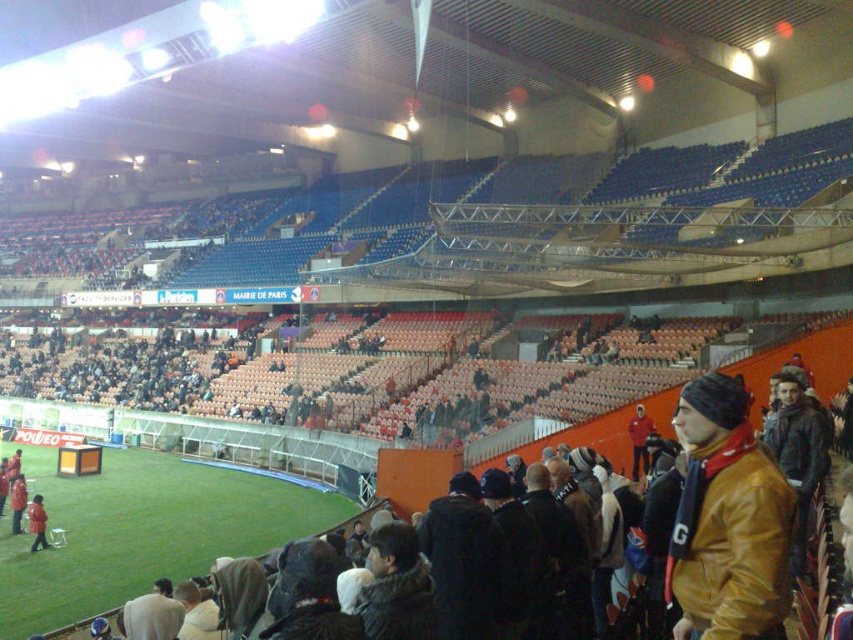
Based on the photo, which of these two, red fabric jacket at right or orange fabric jacket at lower left, stands shorter?

With less height is orange fabric jacket at lower left.

This screenshot has width=853, height=640. What do you see at coordinates (639, 440) in the screenshot? I see `red fabric jacket at right` at bounding box center [639, 440].

In order to click on red fabric jacket at right in this screenshot , I will do pyautogui.click(x=639, y=440).

Is brown leather jacket at lower right smaller than red leather jacket at lower left?

No.

Based on the photo, between brown leather jacket at lower right and red leather jacket at lower left, which one is positioned lower?

red leather jacket at lower left

Between point (761, 538) and point (10, 502), which one is positioned in front?

Point (761, 538) is in front.

The height and width of the screenshot is (640, 853). Find the location of `brown leather jacket at lower right`. brown leather jacket at lower right is located at coordinates (727, 520).

Which is more to the left, brown leather jacket at lower right or red fabric jacket at right?

From the viewer's perspective, brown leather jacket at lower right appears more on the left side.

Does brown leather jacket at lower right have a smaller size compared to red fabric jacket at right?

Actually, brown leather jacket at lower right might be larger than red fabric jacket at right.

This screenshot has width=853, height=640. What do you see at coordinates (727, 520) in the screenshot?
I see `brown leather jacket at lower right` at bounding box center [727, 520].

Image resolution: width=853 pixels, height=640 pixels. Identify the location of brown leather jacket at lower right. (727, 520).